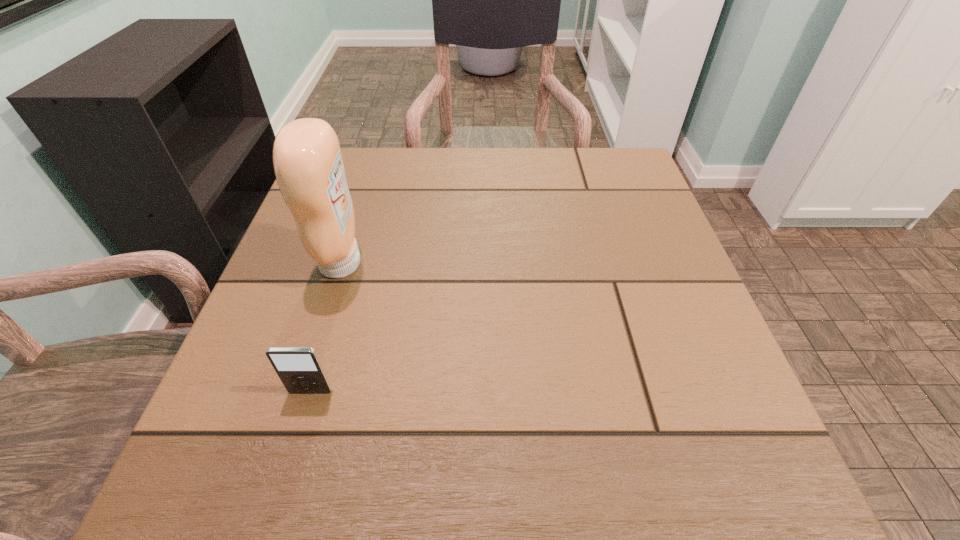
Where is `the taller object`? The image size is (960, 540). the taller object is located at coordinates (307, 159).

What are the coordinates of `condiment` in the screenshot? It's located at (307, 159).

Locate an element on the screen. The width and height of the screenshot is (960, 540). the nearer object is located at coordinates (299, 368).

Locate an element on the screen. This screenshot has width=960, height=540. the shorter object is located at coordinates (299, 368).

I want to click on vacant space located on the label of the condiment, so pos(520,263).

Identify the location of free location located 0.120m on the front-facing side of the shorter object. The width and height of the screenshot is (960, 540). (285, 478).

Find the location of `condiment present at the left edge`. condiment present at the left edge is located at coordinates [x=307, y=159].

The image size is (960, 540). Identify the location of iPod positioned at the left edge. (299, 368).

In the image, there is a desktop. What are the coordinates of `vacant area at the far edge` in the screenshot? It's located at (410, 197).

In the image, there is a desktop. At what (x,y) coordinates should I click in order to perform the action: click on vacant space at the near edge. Please return your answer as a coordinate pair (x, y). This screenshot has width=960, height=540. Looking at the image, I should click on (635, 448).